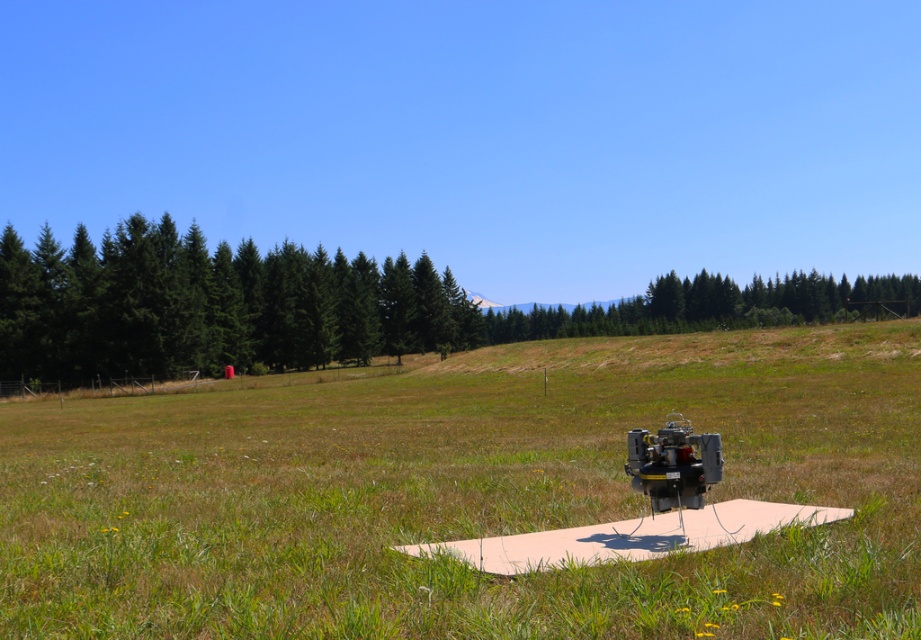
You are standing in the open grassy field and see two points marked on the ground. The first point is at coordinates point (433, 284) and the second point is at coordinates point (485, 330). Which point is closer to you?

Point (433, 284) is closer to the viewer than point (485, 330).

You are a gardener planning to mow the green grass at center and trim the green matte trees at left. Based on their heights, which one would require a taller ladder for the trimming task?

The green matte trees at left are taller than the green grass at center, so you would need a taller ladder for trimming the green matte trees at left.